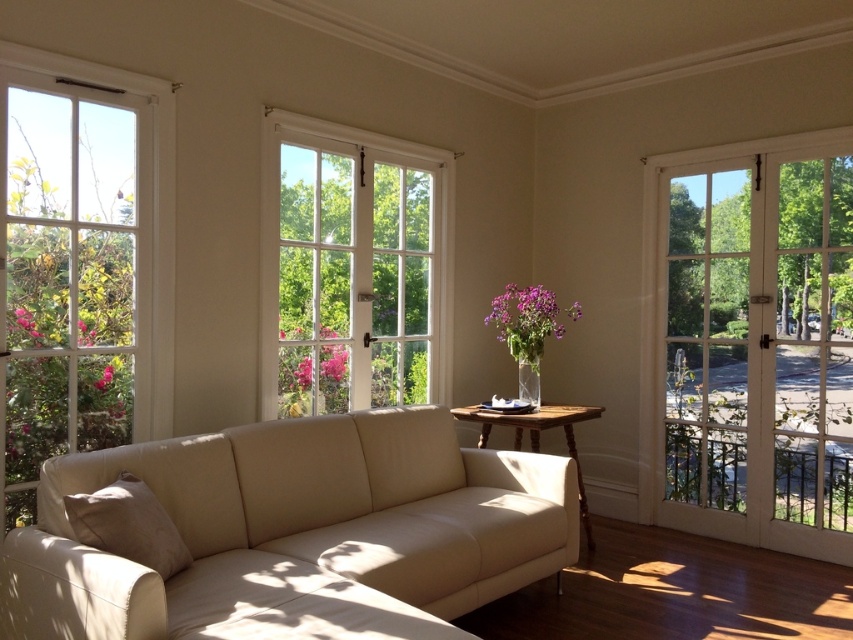
You are planning to hang a large painting on the wall between the clear glass window at left and the white wooden window at center. Which window should the painting be closer to if you want it to be closer to the smaller window?

The painting should be placed closer to the clear glass window at left because it is the smaller window between the two.

You are a delivery person trying to bring a tall package into the living room. The package is 2 meters tall. You see the beige leather couch at center and the white wooden door at right. Which object is shorter and can the package fit through the doorway?

The beige leather couch at center is shorter than the white wooden door at right. However, the white wooden door at right is the doorway, so the package cannot fit through it since its height is 2 meters, which is taller than the door.